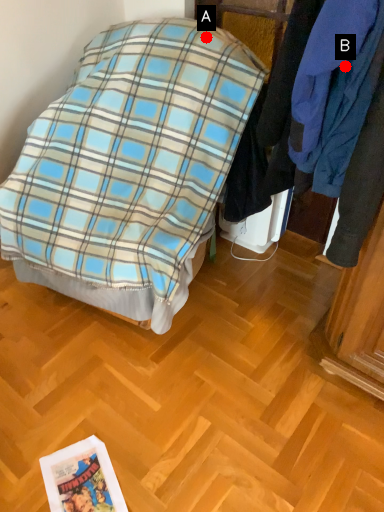
Question: Two points are circled on the image, labeled by A and B beside each circle. Which point is further to the camera?

Choices:
 (A) A is further
 (B) B is further

Answer: (A)